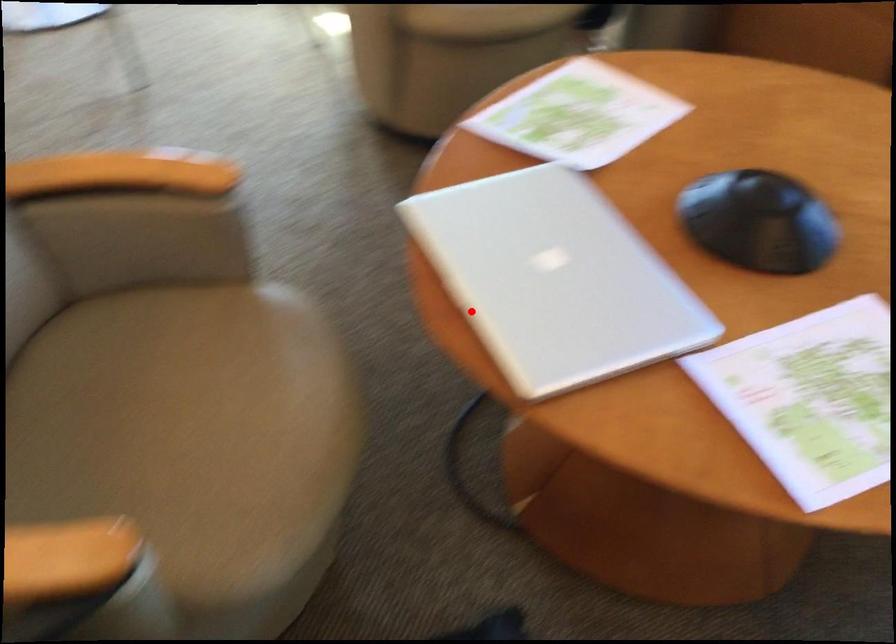
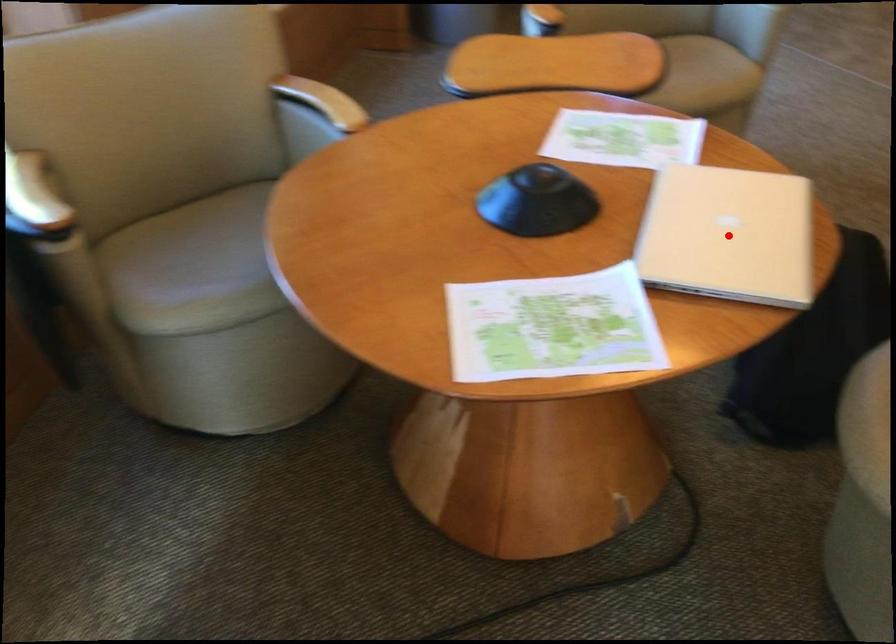
I am providing you with two images of the same scene from different viewpoints. A red point is marked on the first image and another point is marked on the second image. Does the point marked in image1 correspond to the same location as the one in image2?

Yes